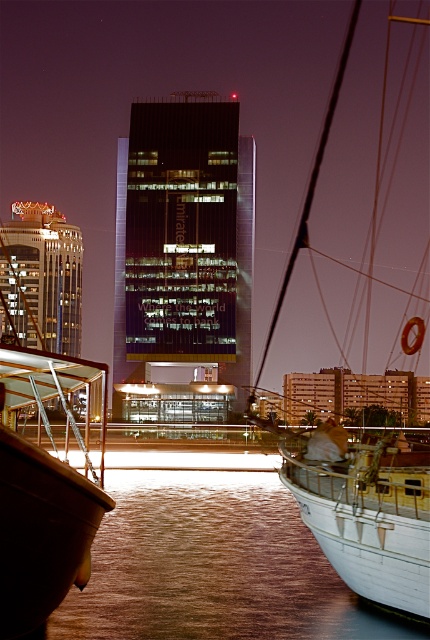
Is brown liquid water at lower center to the left of white wooden boat at right from the viewer's perspective?

Yes, brown liquid water at lower center is to the left of white wooden boat at right.

Who is more forward, (205, 605) or (264, 362)?

Point (205, 605) is more forward.

Between point (108, 604) and point (418, 580), which one is positioned behind?

Positioned behind is point (108, 604).

Where is `brown liquid water at lower center`? The height and width of the screenshot is (640, 430). brown liquid water at lower center is located at coordinates (212, 566).